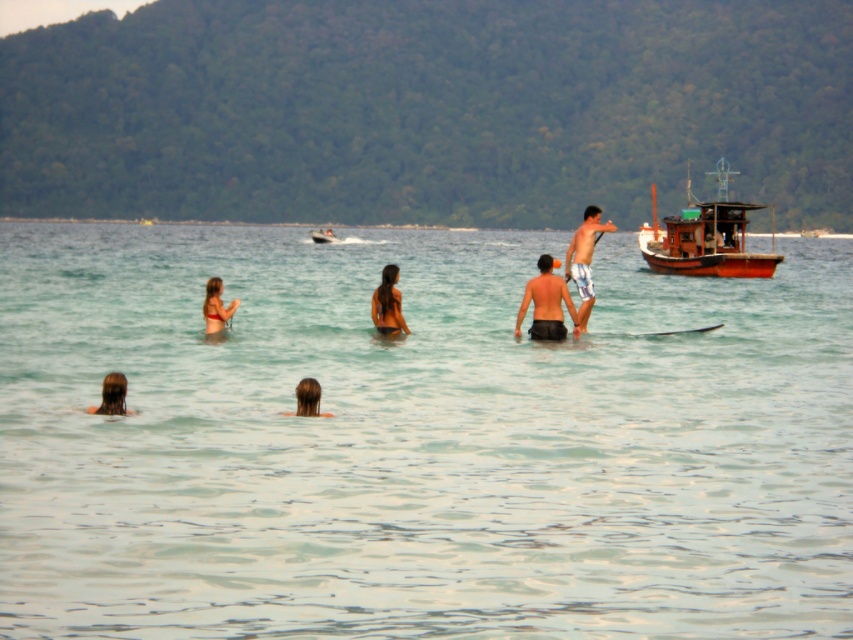
Question: Is light blue striped shorts at center smaller than brown hair at lower center?

Choices:
 (A) no
 (B) yes

Answer: (A)

Question: Observing the image, what is the correct spatial positioning of wooden boat at right in reference to light blue striped shorts at center?

Choices:
 (A) below
 (B) above

Answer: (B)

Question: Does light blue striped shorts at center have a lesser width compared to matte bikini at center?

Choices:
 (A) yes
 (B) no

Answer: (B)

Question: Which object is the closest to the light blue striped shorts at center?

Choices:
 (A) blonde hair at lower left
 (B) matte bikini at center
 (C) metallic silver boat at center

Answer: (B)

Question: Which point appears closest to the camera in this image?

Choices:
 (A) (325, 232)
 (B) (103, 385)
 (C) (723, 228)
 (D) (312, 381)

Answer: (B)

Question: Which of the following is the farthest from the observer?

Choices:
 (A) matte bikini at center
 (B) blonde hair at lower left

Answer: (A)